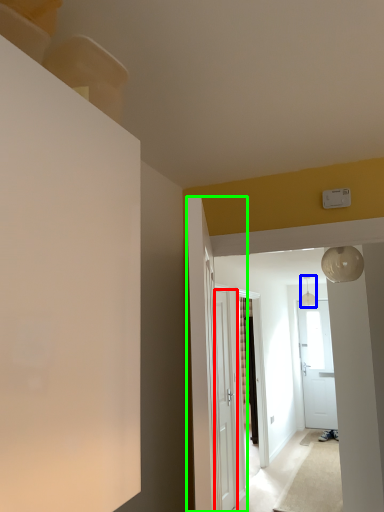
Question: Which is nearer to the door (highlighted by a red box)? light fixture (highlighted by a blue box) or door (highlighted by a green box).

Choices:
 (A) light fixture
 (B) door

Answer: (B)